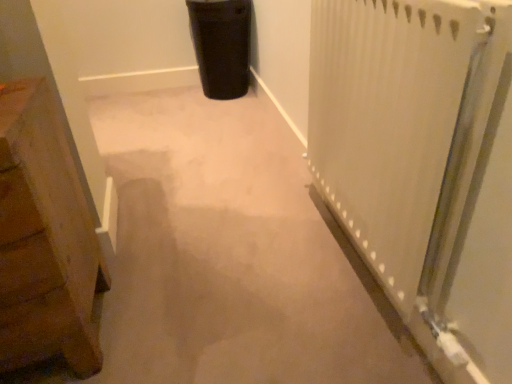
Question: Is wooden chest at left thinner than black matte trash can at upper center?

Choices:
 (A) no
 (B) yes

Answer: (A)

Question: From the image's perspective, is wooden chest at left on top of black matte trash can at upper center?

Choices:
 (A) yes
 (B) no

Answer: (B)

Question: Are wooden chest at left and black matte trash can at upper center making contact?

Choices:
 (A) no
 (B) yes

Answer: (A)

Question: Does wooden chest at left have a lesser height compared to black matte trash can at upper center?

Choices:
 (A) no
 (B) yes

Answer: (A)

Question: Is wooden chest at left positioned with its back to black matte trash can at upper center?

Choices:
 (A) no
 (B) yes

Answer: (A)

Question: Can you confirm if wooden chest at left is bigger than black matte trash can at upper center?

Choices:
 (A) yes
 (B) no

Answer: (A)

Question: From the image's perspective, is white textured radiator at right on top of wooden chest at left?

Choices:
 (A) yes
 (B) no

Answer: (A)

Question: Does white textured radiator at right have a smaller size compared to wooden chest at left?

Choices:
 (A) no
 (B) yes

Answer: (B)

Question: Is white textured radiator at right surrounding wooden chest at left?

Choices:
 (A) no
 (B) yes

Answer: (A)

Question: Can you confirm if white textured radiator at right is thinner than wooden chest at left?

Choices:
 (A) yes
 (B) no

Answer: (A)

Question: Is white textured radiator at right beside wooden chest at left?

Choices:
 (A) no
 (B) yes

Answer: (A)

Question: Is white textured radiator at right outside wooden chest at left?

Choices:
 (A) no
 (B) yes

Answer: (B)

Question: From a real-world perspective, does white textured radiator at right stand above black matte trash can at upper center?

Choices:
 (A) no
 (B) yes

Answer: (B)